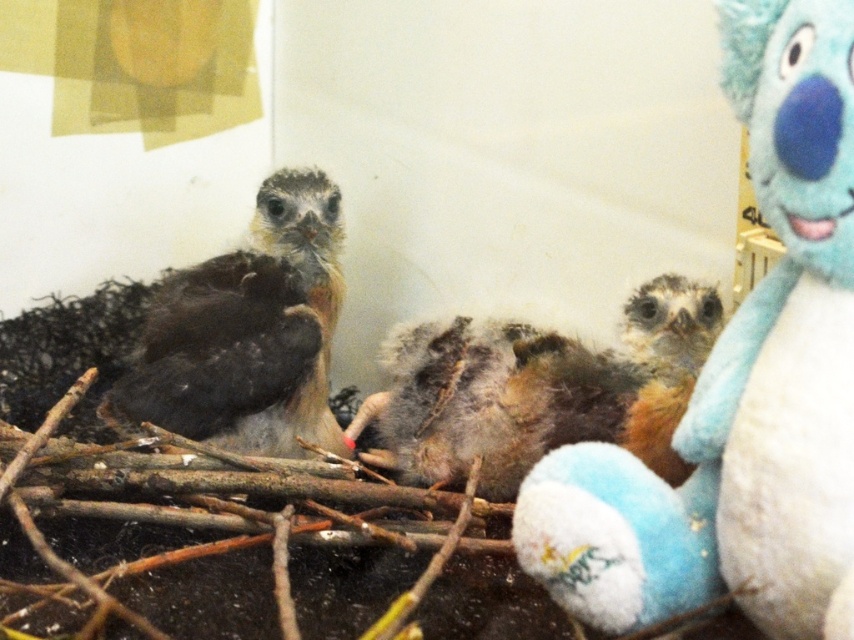
Question: Which point is farther from the camera taking this photo?

Choices:
 (A) (215, 381)
 (B) (389, 406)
 (C) (782, 288)

Answer: (B)

Question: Which point is farther from the camera taking this photo?

Choices:
 (A) (756, 570)
 (B) (460, 426)

Answer: (B)

Question: Is fluffy blue plush at right thinner than fuzzy brown bird at center?

Choices:
 (A) yes
 (B) no

Answer: (A)

Question: Does fluffy blue plush at right appear under fuzzy brown bird at center?

Choices:
 (A) no
 (B) yes

Answer: (A)

Question: Which point is closer to the camera?

Choices:
 (A) [300, 195]
 (B) [642, 339]

Answer: (B)

Question: Can you confirm if fuzzy brown bird at center is positioned to the right of brown fluffy bird at left?

Choices:
 (A) no
 (B) yes

Answer: (B)